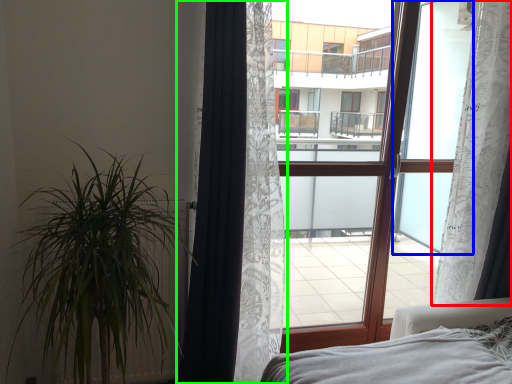
Question: Based on their relative distances, which object is nearer to curtain (highlighted by a red box)? Choose from window screen (highlighted by a blue box) and curtain (highlighted by a green box).

Choices:
 (A) window screen
 (B) curtain

Answer: (A)